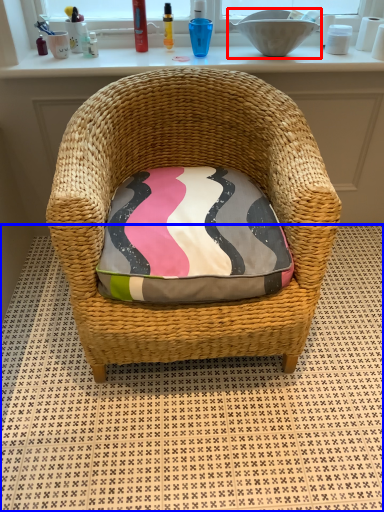
Question: Which point is closer to the camera, sink (highlighted by a red box) or tile (highlighted by a blue box)?

Choices:
 (A) sink
 (B) tile

Answer: (B)